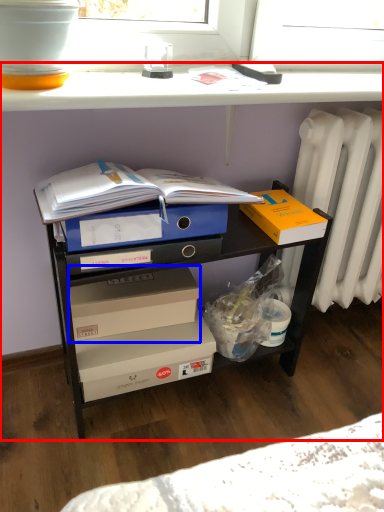
Question: Which object appears farthest to the camera in this image, desk (highlighted by a red box) or box (highlighted by a blue box)?

Choices:
 (A) desk
 (B) box

Answer: (B)